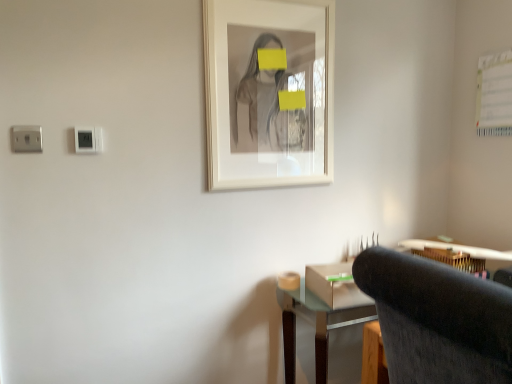
Question: Which is correct: white plastic electric outlet at upper left is inside wooden desk at lower right, or outside of it?

Choices:
 (A) inside
 (B) outside

Answer: (B)

Question: Based on their sizes in the image, would you say white plastic electric outlet at upper left is bigger or smaller than wooden desk at lower right?

Choices:
 (A) big
 (B) small

Answer: (B)

Question: Considering the real-world distances, which object is closest to the white matte picture frame at center?

Choices:
 (A) dark gray fabric chair at lower right
 (B) wooden desk at lower right
 (C) white plastic electric outlet at upper left

Answer: (C)

Question: Which object is the farthest from the white matte picture frame at center?

Choices:
 (A) dark gray fabric chair at lower right
 (B) wooden desk at lower right
 (C) white plastic electric outlet at upper left

Answer: (A)